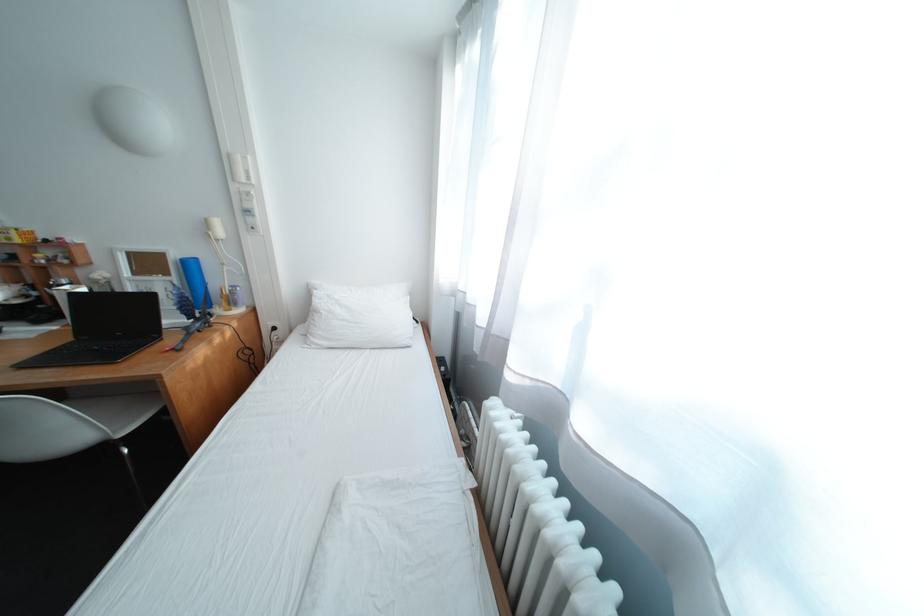
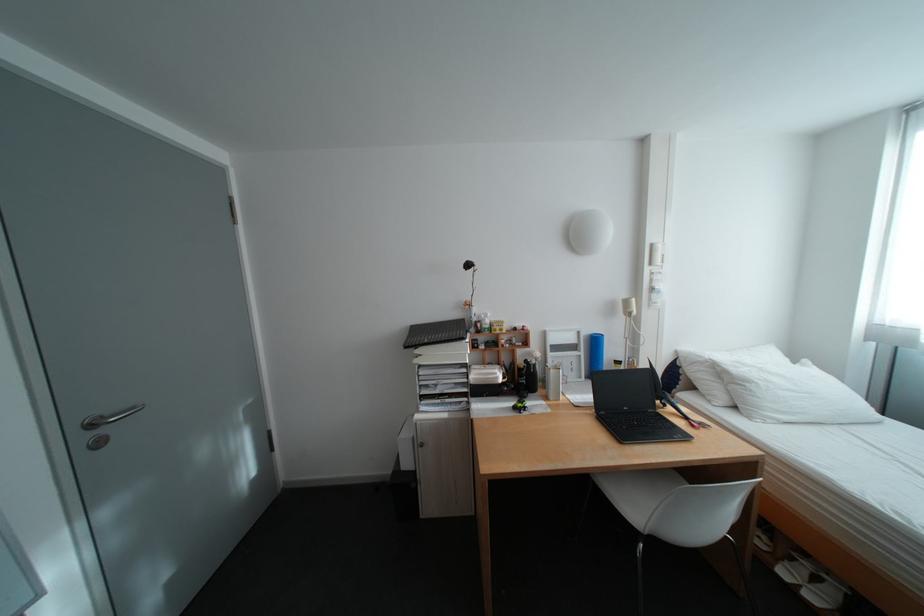
Find the pixel in the second image that matches the point at 187,280 in the first image.

(594, 354)